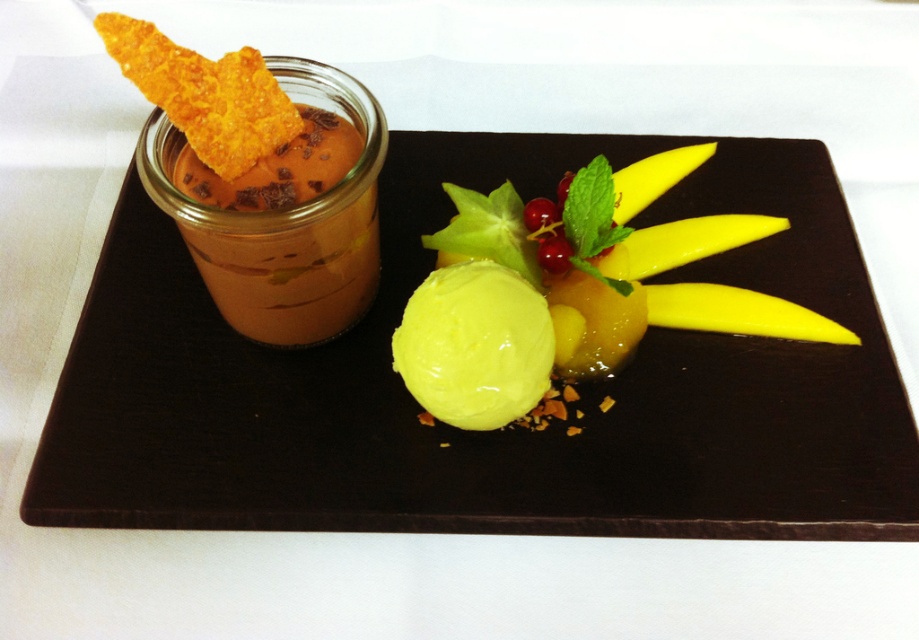
Question: Does matte brown jar at upper left lie in front of yellow smooth ice cream at center?

Choices:
 (A) yes
 (B) no

Answer: (B)

Question: Based on their relative distances, which object is nearer to the yellow smooth ice cream at center?

Choices:
 (A) yellow glossy ice cream at center
 (B) matte brown jar at upper left

Answer: (A)

Question: Can you confirm if matte brown jar at upper left is bigger than yellow glossy ice cream at center?

Choices:
 (A) no
 (B) yes

Answer: (B)

Question: Among these points, which one is farthest from the camera?

Choices:
 (A) (422, 460)
 (B) (462, 358)

Answer: (A)

Question: Which point is farther from the camera taking this photo?

Choices:
 (A) (530, 385)
 (B) (412, 337)

Answer: (A)

Question: Does matte brown jar at upper left have a lesser width compared to yellow glossy ice cream at center?

Choices:
 (A) no
 (B) yes

Answer: (A)